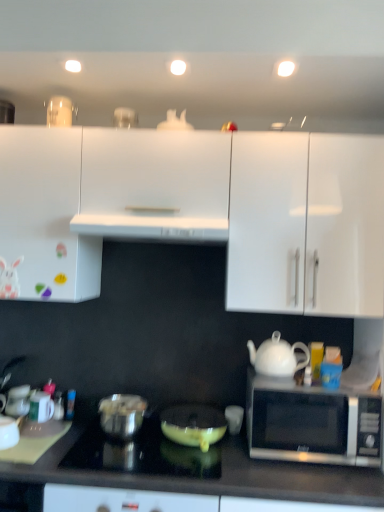
Question: Does white glossy mug at lower left turn towards matte yellow frying pan at center, which is counted as the 3th appliance, starting from the left?

Choices:
 (A) no
 (B) yes

Answer: (A)

Question: Considering the relative sizes of white glossy mug at lower left and matte yellow frying pan at center, the first appliance from the right, in the image provided, is white glossy mug at lower left shorter than matte yellow frying pan at center, the first appliance from the right,?

Choices:
 (A) yes
 (B) no

Answer: (A)

Question: Is white glossy mug at lower left bigger than matte yellow frying pan at center, the first appliance from the right?

Choices:
 (A) yes
 (B) no

Answer: (B)

Question: Is white glossy mug at lower left not inside matte yellow frying pan at center, which is counted as the 3th appliance, starting from the left?

Choices:
 (A) yes
 (B) no

Answer: (A)

Question: Is white glossy mug at lower left positioned far away from matte yellow frying pan at center, which is counted as the 3th appliance, starting from the left?

Choices:
 (A) no
 (B) yes

Answer: (A)

Question: From a real-world perspective, is white glossy mug at lower left positioned over matte yellow frying pan at center, the first appliance from the right, based on gravity?

Choices:
 (A) no
 (B) yes

Answer: (A)

Question: Could you tell me if shiny black cooktop at center is facing white glossy mug at lower left?

Choices:
 (A) no
 (B) yes

Answer: (A)

Question: Is shiny black cooktop at center thinner than white glossy mug at lower left?

Choices:
 (A) yes
 (B) no

Answer: (B)

Question: Is shiny black cooktop at center positioned in front of white glossy mug at lower left?

Choices:
 (A) yes
 (B) no

Answer: (A)

Question: From a real-world perspective, is shiny black cooktop at center below white glossy mug at lower left?

Choices:
 (A) no
 (B) yes

Answer: (B)

Question: Would you say shiny black cooktop at center is outside white glossy mug at lower left?

Choices:
 (A) yes
 (B) no

Answer: (A)

Question: From the image's perspective, is shiny black cooktop at center located above white glossy mug at lower left?

Choices:
 (A) yes
 (B) no

Answer: (B)

Question: Is white glossy mug at lower left completely or partially outside of white glossy teapot at right?

Choices:
 (A) no
 (B) yes

Answer: (B)